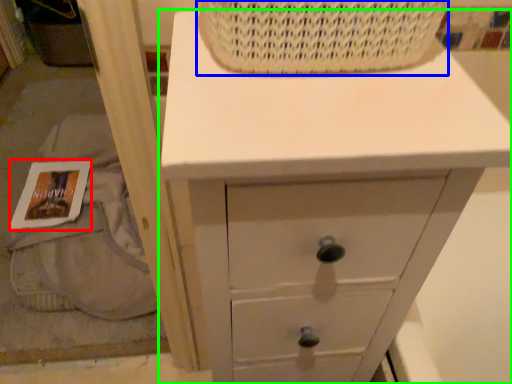
Question: Considering the real-world distances, which object is farthest from magazine (highlighted by a red box)? basket (highlighted by a blue box) or chest of drawers (highlighted by a green box)?

Choices:
 (A) basket
 (B) chest of drawers

Answer: (A)